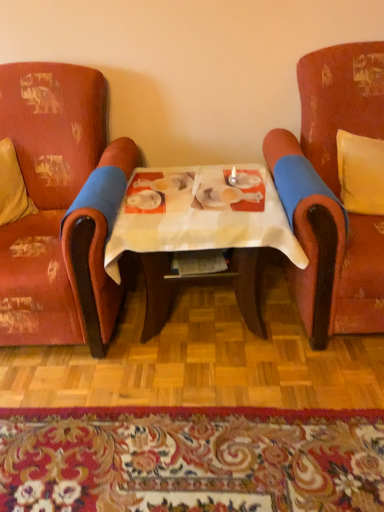
Find the location of a particular element. vacant space underneath white paper table at center (from a real-world perspective) is located at coordinates (203, 326).